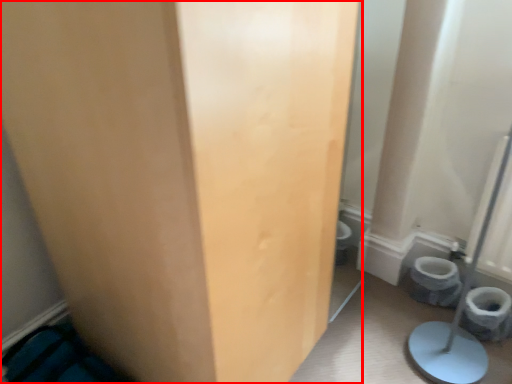
Question: From the image's perspective, what is the correct spatial positioning of door (annotated by the red box) in reference to toilet bowl?

Choices:
 (A) above
 (B) below

Answer: (A)